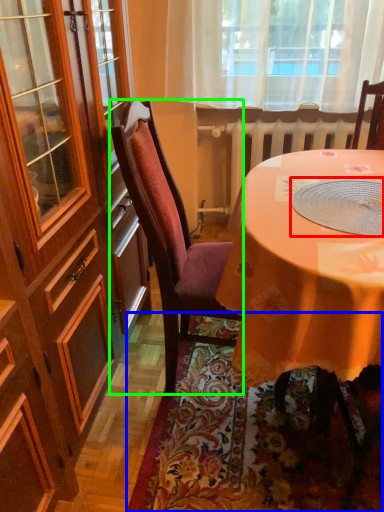
Question: Based on their relative distances, which object is nearer to tableware (highlighted by a red box)? Choose from mat (highlighted by a blue box) and chair (highlighted by a green box).

Choices:
 (A) mat
 (B) chair

Answer: (B)